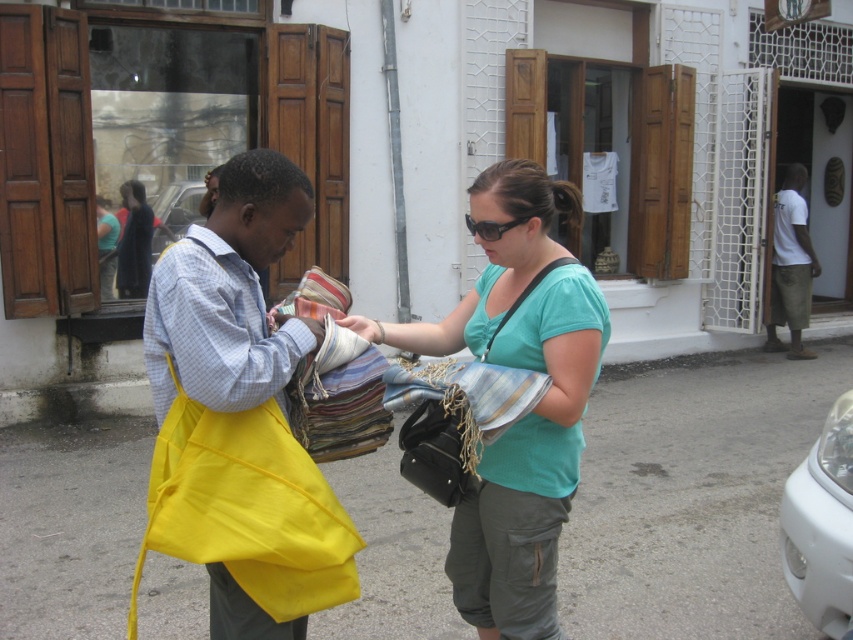
You are a pedestrian standing on the sidewalk and see the teal cotton shirt at center and the metallic silver car at center in the street. Which one is positioned more to the right from your viewpoint?

The teal cotton shirt at center is positioned more to the right than the metallic silver car at center from your viewpoint.

You are a delivery person trying to determine if the white glossy car at right can fit under a low clearance bridge that is only as tall as the white cotton shirt at right. Based on the scene, will the car pass under the bridge without hitting it?

The white glossy car at right has a lesser height compared to the white cotton shirt at right, so the car is shorter than the shirt. Since the bridge has a clearance equal to the shirt, the car should pass under it without any issues.